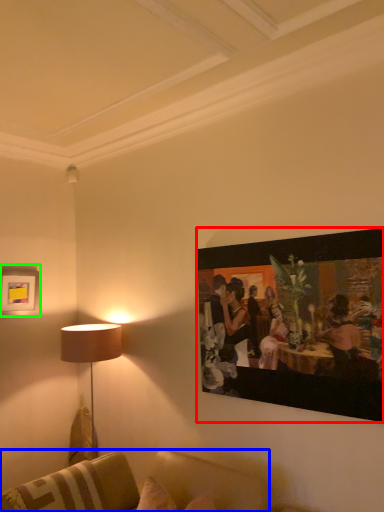
Question: Based on their relative distances, which object is nearer to picture frame (highlighted by a red box)? Choose from studio couch (highlighted by a blue box) and picture frame (highlighted by a green box).

Choices:
 (A) studio couch
 (B) picture frame

Answer: (A)